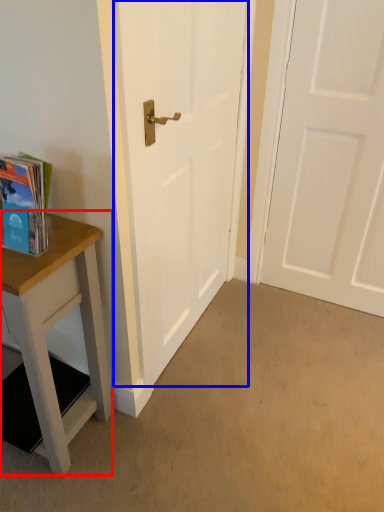
Question: Among these objects, which one is farthest to the camera, table (highlighted by a red box) or door (highlighted by a blue box)?

Choices:
 (A) table
 (B) door

Answer: (B)